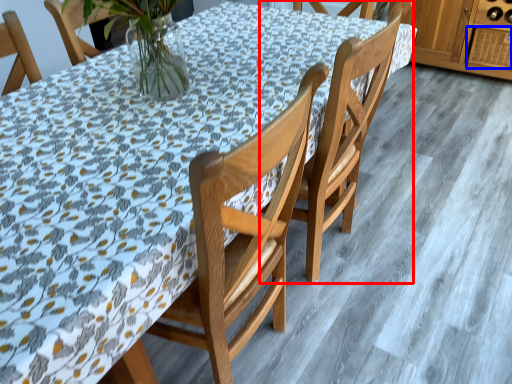
Question: Which object is further to the camera taking this photo, chair (highlighted by a red box) or drawer (highlighted by a blue box)?

Choices:
 (A) chair
 (B) drawer

Answer: (B)